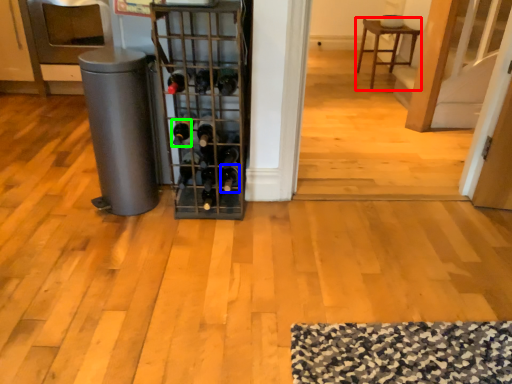
Question: Which object is the farthest from furniture (highlighted by a red box)? Choose among these: wine bottle (highlighted by a blue box) or wine bottle (highlighted by a green box).

Choices:
 (A) wine bottle
 (B) wine bottle

Answer: (B)